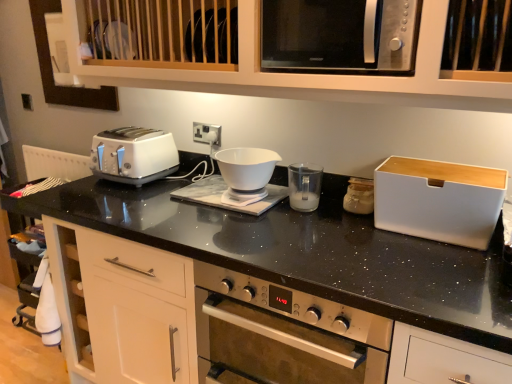
Question: From the image's perspective, would you say white plastic toaster at left is shown under white plastic cup at center, arranged as the first appliance when viewed from the left?

Choices:
 (A) no
 (B) yes

Answer: (A)

Question: Is white plastic toaster at left further to camera compared to white plastic cup at center, arranged as the first appliance when viewed from the left?

Choices:
 (A) yes
 (B) no

Answer: (A)

Question: Is white plastic cup at center, marked as the third appliance in a right-to-left arrangement, surrounded by white plastic toaster at left?

Choices:
 (A) no
 (B) yes

Answer: (A)

Question: From a real-world perspective, is white plastic toaster at left physically above white plastic cup at center, arranged as the first appliance when viewed from the left?

Choices:
 (A) no
 (B) yes

Answer: (B)

Question: From a real-world perspective, is white plastic toaster at left beneath white plastic cup at center, marked as the third appliance in a right-to-left arrangement?

Choices:
 (A) yes
 (B) no

Answer: (B)

Question: Considering their positions, is satin silver microwave at upper center located in front of or behind white plastic bread bin at right, the 3th appliance when ordered from left to right?

Choices:
 (A) behind
 (B) front

Answer: (B)

Question: From the image's perspective, is satin silver microwave at upper center located above or below white plastic bread bin at right, the 3th appliance when ordered from left to right?

Choices:
 (A) above
 (B) below

Answer: (A)

Question: Based on their sizes in the image, would you say satin silver microwave at upper center is bigger or smaller than white plastic bread bin at right, marked as the first appliance in a right-to-left arrangement?

Choices:
 (A) small
 (B) big

Answer: (B)

Question: Is satin silver microwave at upper center inside or outside of white plastic bread bin at right, the 3th appliance when ordered from left to right?

Choices:
 (A) outside
 (B) inside

Answer: (A)

Question: Considering the positions of point (226, 206) and point (309, 39), is point (226, 206) closer or farther from the camera than point (309, 39)?

Choices:
 (A) farther
 (B) closer

Answer: (B)

Question: Is white glossy coffee machine at center inside or outside of satin silver microwave at upper center?

Choices:
 (A) inside
 (B) outside

Answer: (B)

Question: From a real-world perspective, relative to satin silver microwave at upper center, is white glossy coffee machine at center vertically above or below?

Choices:
 (A) below
 (B) above

Answer: (A)

Question: Is white glossy coffee machine at center wider or thinner than satin silver microwave at upper center?

Choices:
 (A) wide
 (B) thin

Answer: (B)

Question: In the image, is white glossy coffee machine at center on the left side or the right side of white plastic bread bin at right, marked as the first appliance in a right-to-left arrangement?

Choices:
 (A) left
 (B) right

Answer: (A)

Question: From the image's perspective, is white glossy coffee machine at center above or below white plastic bread bin at right, the 3th appliance when ordered from left to right?

Choices:
 (A) above
 (B) below

Answer: (A)